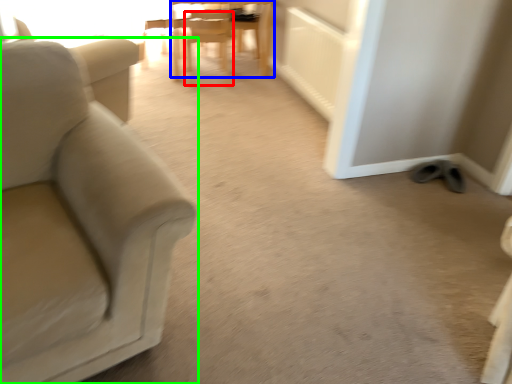
Question: Based on their relative distances, which object is farther from chair (highlighted by a red box)? Choose from chair (highlighted by a blue box) and chair (highlighted by a green box).

Choices:
 (A) chair
 (B) chair

Answer: (B)